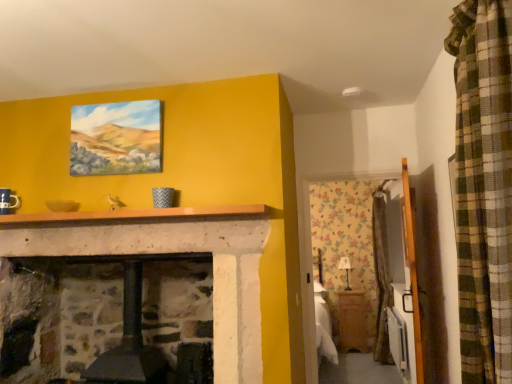
Find the location of a particular element. free region under matte canvas painting at upper center (from a real-world perspective) is located at coordinates (119, 206).